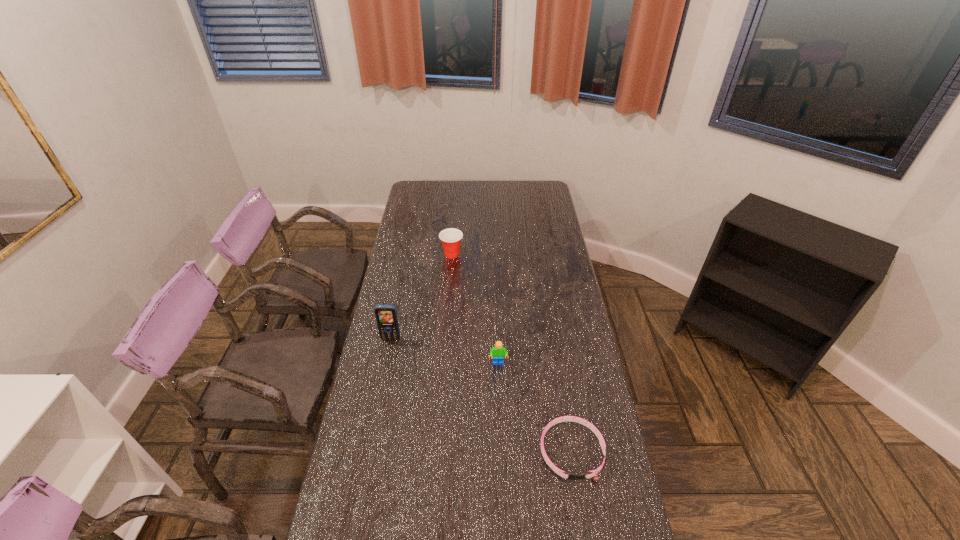
Find the location of a particular element. The width and height of the screenshot is (960, 540). vacant space located 0.340m on the face of the second nearest object is located at coordinates (502, 460).

Locate an element on the screen. vacant space located with the buckle on the dog collar is located at coordinates (x=582, y=510).

Find the location of a particular element. The image size is (960, 540). object at the left edge is located at coordinates (386, 315).

Locate an element on the screen. This screenshot has width=960, height=540. object situated at the right edge is located at coordinates (573, 476).

Locate an element on the screen. This screenshot has height=540, width=960. vacant area at the far edge is located at coordinates (504, 185).

Where is `free region at the left edge`? free region at the left edge is located at coordinates (420, 258).

Identify the location of vacant region at the right edge of the desktop. The width and height of the screenshot is (960, 540). (553, 231).

You are a GUI agent. You are given a task and a screenshot of the screen. Output one action in this format:
    pyautogui.click(x=<x>, y=<y>)
    Task: Click on the free location at the far left corner
    The image size is (960, 540).
    Given the screenshot: What is the action you would take?
    pyautogui.click(x=420, y=195)

This screenshot has height=540, width=960. In order to click on vacant space at the far right corner of the desktop in this screenshot , I will do `click(540, 201)`.

At what (x,y) coordinates should I click in order to perform the action: click on vacant space in between the farthest object and the third farthest object. Please return your answer as a coordinate pair (x, y). The height and width of the screenshot is (540, 960). Looking at the image, I should click on (475, 309).